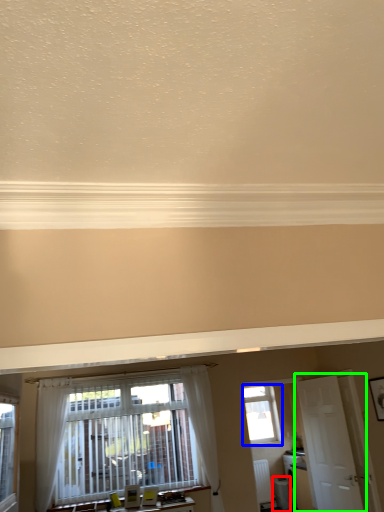
Question: Which object is positioned farthest from appliance (highlighted by a red box)? Select from window (highlighted by a blue box) and door (highlighted by a green box).

Choices:
 (A) window
 (B) door

Answer: (B)